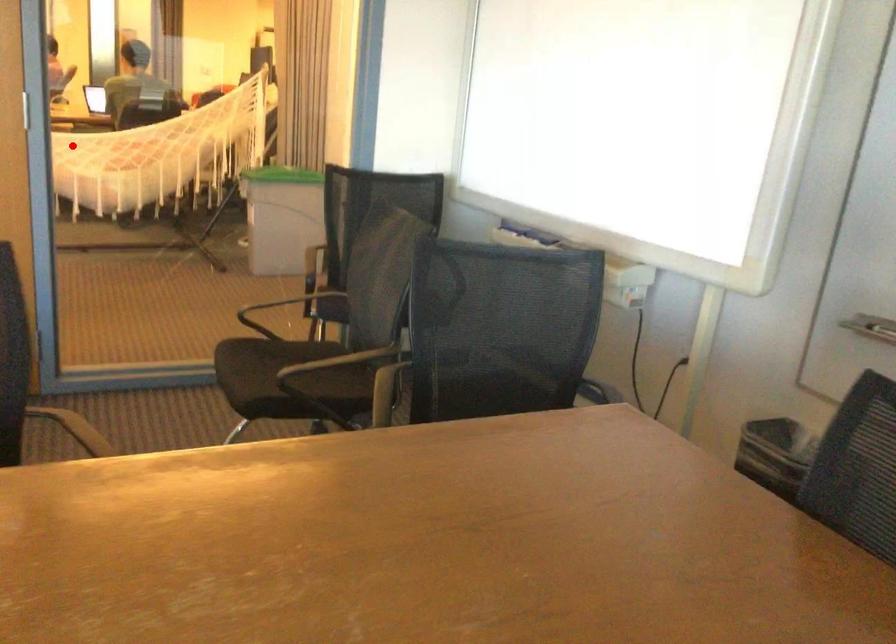
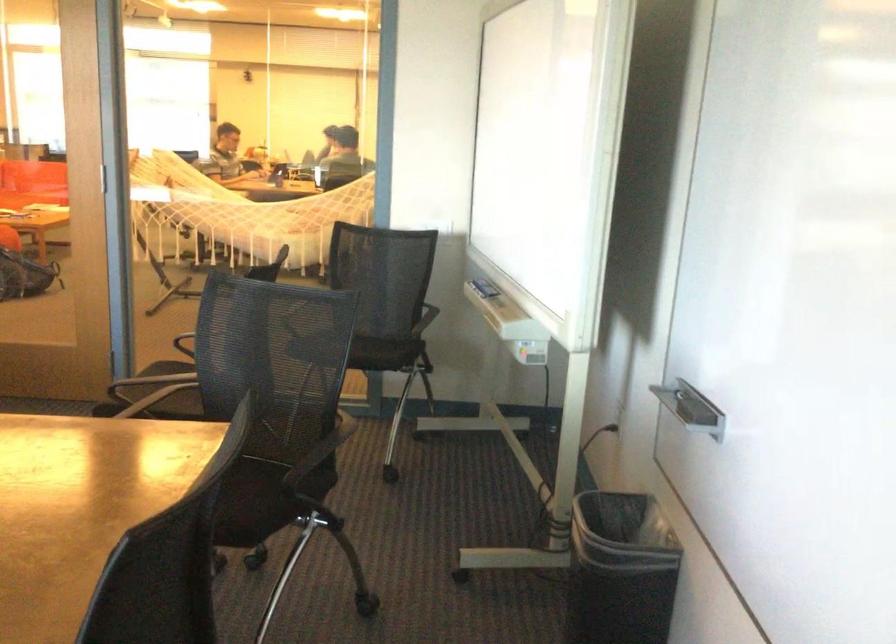
Where in the second image is the point corresponding to the highlighted location from the first image?

(246, 213)